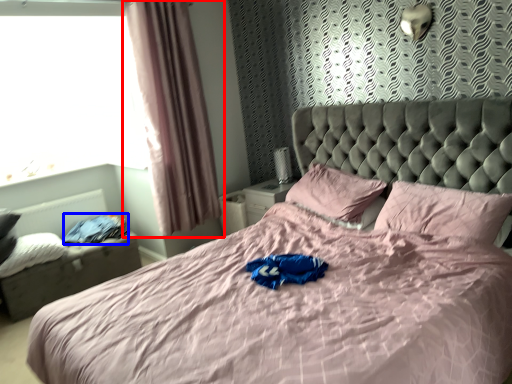
Question: Which object is further to the camera taking this photo, curtain (highlighted by a red box) or clothing (highlighted by a blue box)?

Choices:
 (A) curtain
 (B) clothing

Answer: (B)